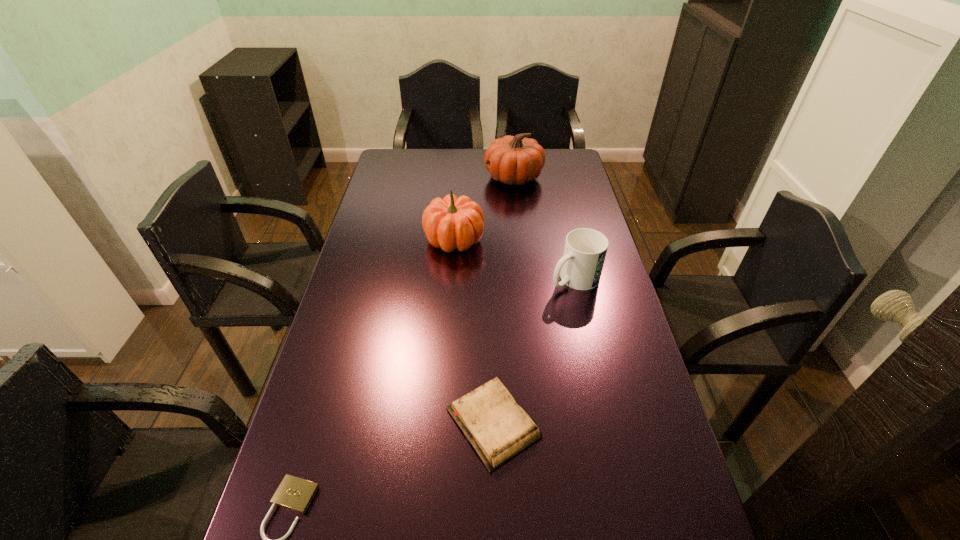
This screenshot has width=960, height=540. In order to click on vacant area situated on the face of the farther pumpkin in this screenshot , I will do `click(455, 177)`.

Identify the location of vacant space located on the front of the left pumpkin. This screenshot has height=540, width=960. (450, 290).

Identify the location of vacant space located 0.260m on the front of the mug. (595, 369).

Locate an element on the screen. Image resolution: width=960 pixels, height=540 pixels. free region located 0.260m on the back of the second shortest object is located at coordinates (491, 303).

Identify the location of object that is at the far edge. (514, 160).

Identify the location of pumpkin located in the right edge section of the desktop. (514, 160).

The height and width of the screenshot is (540, 960). In order to click on mug located at the right edge in this screenshot , I will do `click(585, 250)`.

At what (x,y) coordinates should I click in order to perform the action: click on object at the far right corner. Please return your answer as a coordinate pair (x, y). This screenshot has height=540, width=960. Looking at the image, I should click on (514, 160).

At what (x,y) coordinates should I click in order to perform the action: click on blank space at the far edge of the desktop. Please return your answer as a coordinate pair (x, y). This screenshot has width=960, height=540. Looking at the image, I should click on (444, 158).

In the image, there is a desktop. Where is `free region at the left edge`? free region at the left edge is located at coordinates (394, 214).